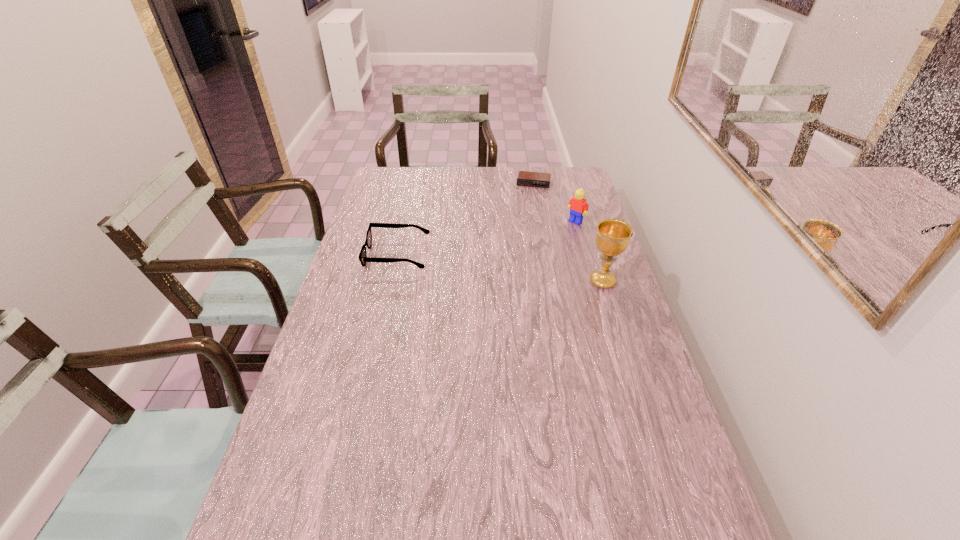
Image resolution: width=960 pixels, height=540 pixels. I want to click on free space located 0.380m on the front-facing side of the second tallest object, so click(x=510, y=276).

Where is `vacant point located on the front-facing side of the second tallest object`? vacant point located on the front-facing side of the second tallest object is located at coordinates (516, 272).

In order to click on free space located on the front face of the third object from right to left in this screenshot , I will do `click(523, 231)`.

What are the coordinates of `vacant space located on the front face of the third object from right to left` in the screenshot? It's located at (527, 211).

The width and height of the screenshot is (960, 540). Find the location of `vacant space located on the front face of the third object from right to left`. vacant space located on the front face of the third object from right to left is located at coordinates (520, 245).

You are a GUI agent. You are given a task and a screenshot of the screen. Output one action in this format:
    pyautogui.click(x=<x>, y=<y>)
    Task: Click on the object that is at the far edge
    This screenshot has width=960, height=540.
    Given the screenshot: What is the action you would take?
    pyautogui.click(x=525, y=178)

Identify the location of object situated at the left edge. The width and height of the screenshot is (960, 540). (363, 258).

Image resolution: width=960 pixels, height=540 pixels. Find the location of `chalice located at the right edge`. chalice located at the right edge is located at coordinates (612, 238).

You are a GUI agent. You are given a task and a screenshot of the screen. Output one action in this format:
    pyautogui.click(x=<x>, y=<y>)
    Task: Click on the Lego present at the right edge
    Image resolution: width=960 pixels, height=540 pixels.
    Given the screenshot: What is the action you would take?
    (578, 207)

I want to click on alarm clock that is at the right edge, so click(x=525, y=178).